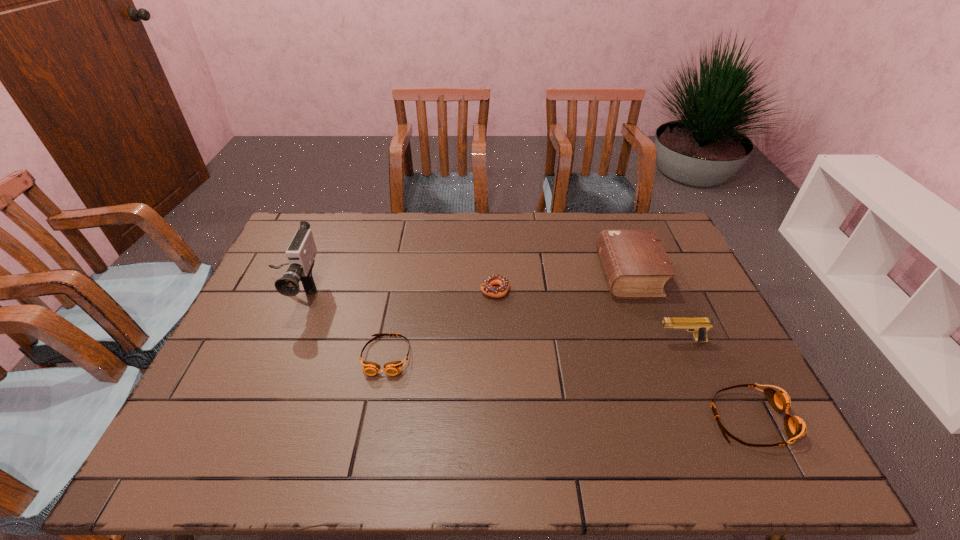
To make them evenly spaced by inserting another goggles among them, please locate a vacant spot for this new goggles. Please provide its 2D coordinates. Your answer should be formatted as a tuple, i.e. [(x, y)], where the tuple contains the x and y coordinates of a point satisfying the conditions above.

[(558, 386)]